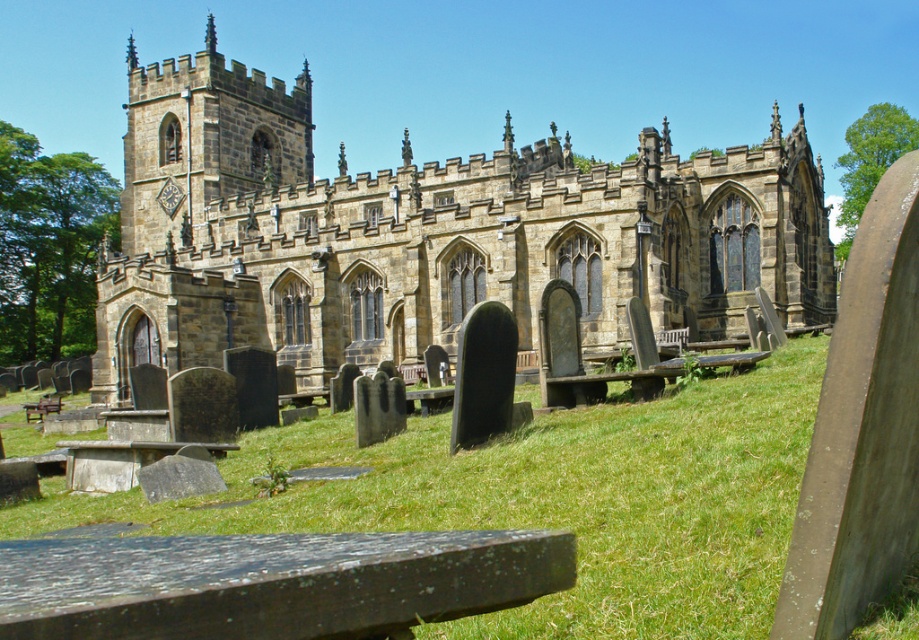
Can you confirm if brown stone church at center is positioned above green grass at center?

Indeed, brown stone church at center is positioned over green grass at center.

Does brown stone church at center appear on the right side of green grass at center?

In fact, brown stone church at center is to the left of green grass at center.

What do you see at coordinates (424, 234) in the screenshot? The height and width of the screenshot is (640, 919). I see `brown stone church at center` at bounding box center [424, 234].

Image resolution: width=919 pixels, height=640 pixels. In order to click on brown stone church at center in this screenshot , I will do `click(424, 234)`.